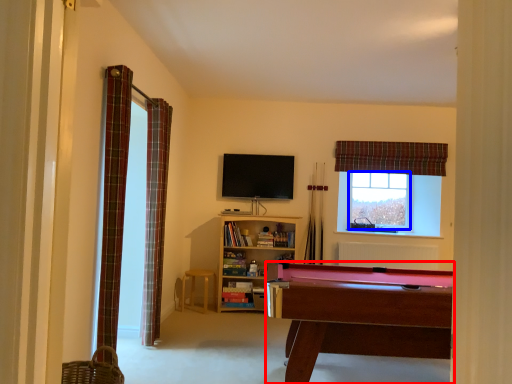
Question: Which point is further to the camera, billiard table (highlighted by a red box) or window screen (highlighted by a blue box)?

Choices:
 (A) billiard table
 (B) window screen

Answer: (B)